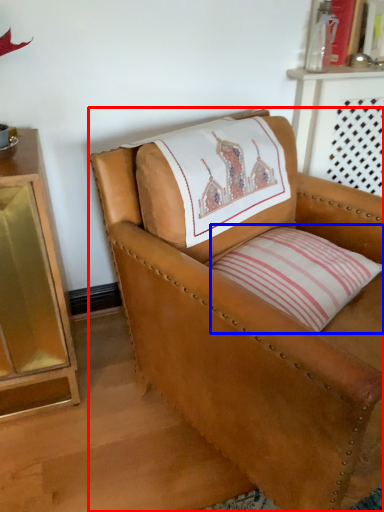
Question: Which object appears closest to the camera in this image, chair (highlighted by a red box) or pillow (highlighted by a blue box)?

Choices:
 (A) chair
 (B) pillow

Answer: (A)